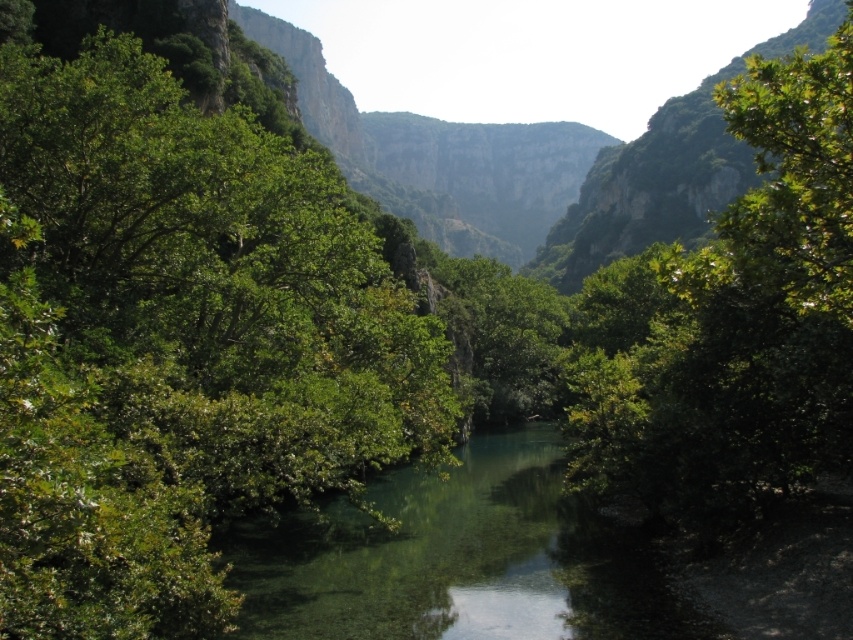
You are a hiker trying to cross the river using a fallen tree as a bridge. The fallen tree is the green leafy tree at left. Can you safely cross the river if the clear water at center is 3 meters wide?

The green leafy tree at left is larger in size than the clear water at center. Since the clear water at center is 3 meters wide, the tree bridge is longer than 3 meters, so it should be safe to cross.

You are a bird flying over the serene natural landscape. You see the green leafy tree at left and the clear water at center. Which object is higher in the scene?

The green leafy tree at left is above the clear water at center, so it is higher in the scene.

You are standing at the point marked as point (177, 342) in the image. What type of object are you currently standing on?

You are standing on a green leafy tree at left, as the point (177, 342) is located on it.